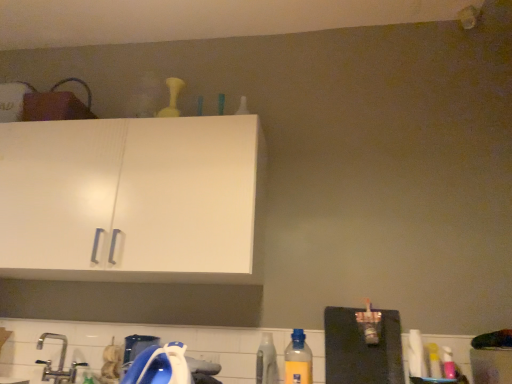
Question: Does yellow plastic bottle at lower center, which is the 2th bottle from top to bottom, have a smaller size compared to yellow matte bottle at upper center, the first bottle in the top-to-bottom sequence?

Choices:
 (A) yes
 (B) no

Answer: (A)

Question: Is yellow plastic bottle at lower center, the 1th bottle in the right-to-left sequence, wider than yellow matte bottle at upper center, the first bottle in the top-to-bottom sequence?

Choices:
 (A) no
 (B) yes

Answer: (A)

Question: Considering the relative sizes of yellow plastic bottle at lower center, arranged as the 3th bottle when viewed from the back, and yellow matte bottle at upper center, which is counted as the 1th bottle, starting from the back, in the image provided, is yellow plastic bottle at lower center, arranged as the 3th bottle when viewed from the back, shorter than yellow matte bottle at upper center, which is counted as the 1th bottle, starting from the back,?

Choices:
 (A) no
 (B) yes

Answer: (B)

Question: From a real-world perspective, is yellow plastic bottle at lower center, arranged as the 3th bottle when viewed from the back, under yellow matte bottle at upper center, the 3th bottle when ordered from right to left?

Choices:
 (A) no
 (B) yes

Answer: (B)

Question: Considering the relative sizes of yellow plastic bottle at lower center, the 1th bottle in the right-to-left sequence, and yellow matte bottle at upper center, placed as the 3th bottle when sorted from front to back, in the image provided, is yellow plastic bottle at lower center, the 1th bottle in the right-to-left sequence, taller than yellow matte bottle at upper center, placed as the 3th bottle when sorted from front to back,?

Choices:
 (A) yes
 (B) no

Answer: (B)

Question: From the image's perspective, is yellow plastic bottle at lower center, arranged as the 3th bottle when viewed from the back, located above yellow matte bottle at upper center, placed as the 3th bottle when sorted from front to back?

Choices:
 (A) yes
 (B) no

Answer: (B)

Question: Does silver metallic faucet at lower left have a greater height compared to yellow plastic bottle at lower center, the 1th bottle positioned from the front?

Choices:
 (A) yes
 (B) no

Answer: (B)

Question: From the image's perspective, is silver metallic faucet at lower left over yellow plastic bottle at lower center, which is the second bottle from bottom to top?

Choices:
 (A) yes
 (B) no

Answer: (B)

Question: Would you say yellow plastic bottle at lower center, the 1th bottle in the right-to-left sequence, is part of silver metallic faucet at lower left's contents?

Choices:
 (A) yes
 (B) no

Answer: (B)

Question: Is silver metallic faucet at lower left facing away from yellow plastic bottle at lower center, which is the second bottle from bottom to top?

Choices:
 (A) yes
 (B) no

Answer: (B)

Question: Considering the relative sizes of silver metallic faucet at lower left and yellow plastic bottle at lower center, which is counted as the third bottle, starting from the left, in the image provided, is silver metallic faucet at lower left wider than yellow plastic bottle at lower center, which is counted as the third bottle, starting from the left,?

Choices:
 (A) no
 (B) yes

Answer: (B)

Question: Is the surface of silver metallic faucet at lower left in direct contact with yellow plastic bottle at lower center, which is the second bottle from bottom to top?

Choices:
 (A) yes
 (B) no

Answer: (B)

Question: Can you confirm if yellow matte bottle at upper center, the 3th bottle when ordered from right to left, is smaller than translucent plastic bottle at lower center, the 2th bottle positioned from the right?

Choices:
 (A) yes
 (B) no

Answer: (B)